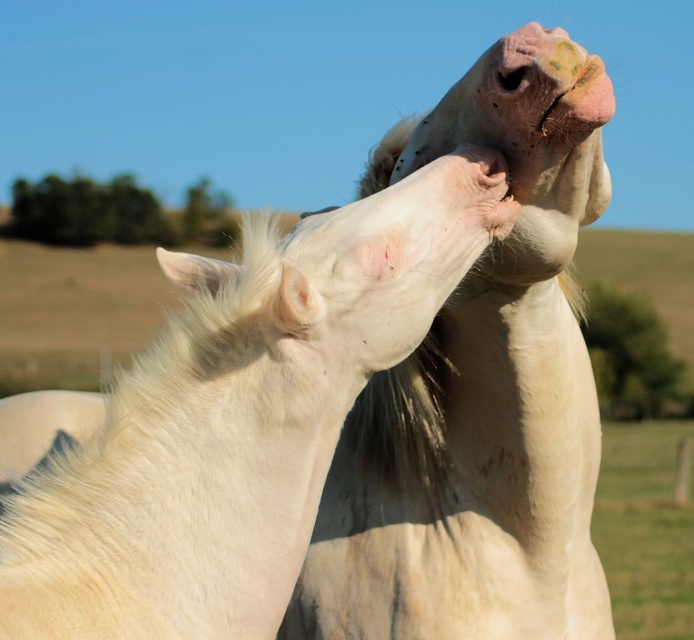
Question: Does white matte horse at upper center appear on the left side of white soft fur at center?

Choices:
 (A) no
 (B) yes

Answer: (B)

Question: Is white matte horse at upper center positioned before white matte horse at center?

Choices:
 (A) yes
 (B) no

Answer: (A)

Question: Which of these objects is positioned farthest from the white soft fur at center?

Choices:
 (A) white matte horse at upper center
 (B) white matte horse at center

Answer: (B)

Question: Which of the following is the closest to the observer?

Choices:
 (A) (378, 388)
 (B) (498, 166)

Answer: (B)

Question: Among these points, which one is farthest from the camera?

Choices:
 (A) (584, 131)
 (B) (489, 208)

Answer: (A)

Question: Does white matte horse at upper center appear on the left side of white soft fur at center?

Choices:
 (A) no
 (B) yes

Answer: (B)